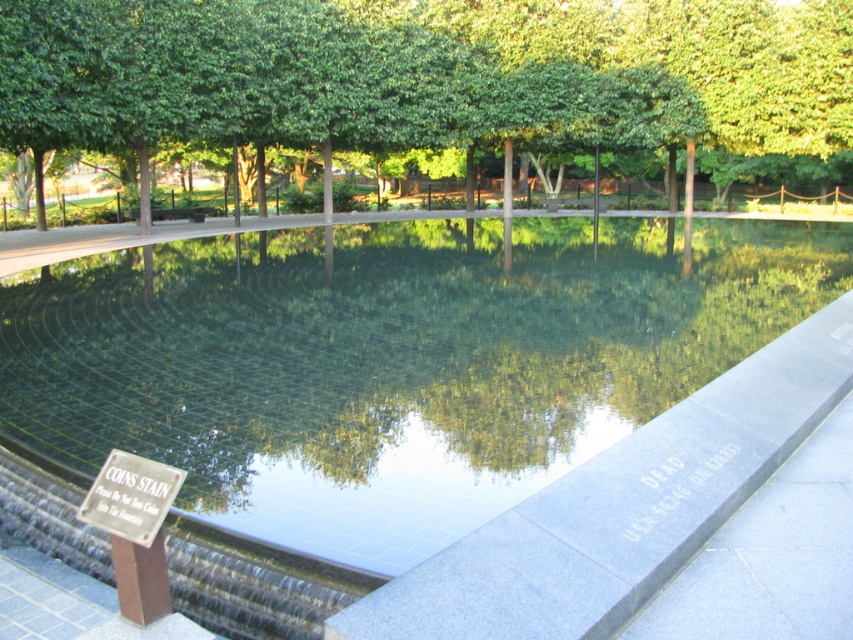
You are standing on the paved walkway near the clear glass pool at center. You want to read the text on the metallic silver sign at lower left. Can you see the text clearly without moving closer to the sign?

The metallic silver sign at lower left is behind the clear glass pool at center. Since the pool is between you and the sign, you might not be able to see the text clearly unless you move closer to the sign.

From the picture: You are standing at the center of the memorial area and want to locate the clear glass pool at center. According to the coordinates provided, in which direction should you move to reach it?

The clear glass pool at center is located at coordinates point [392,362], so you should move towards the center of the memorial area to reach it.

You are standing at the edge of the clear glass pool at center and want to toss a coin into the water. If your arm can reach 1.5 meters, can you successfully toss the coin into the pool without stepping into it?

The clear glass pool at center is 3.71 meters away from the viewer. Since your arm can only reach 1.5 meters, you cannot reach the pool to toss the coin without stepping closer.